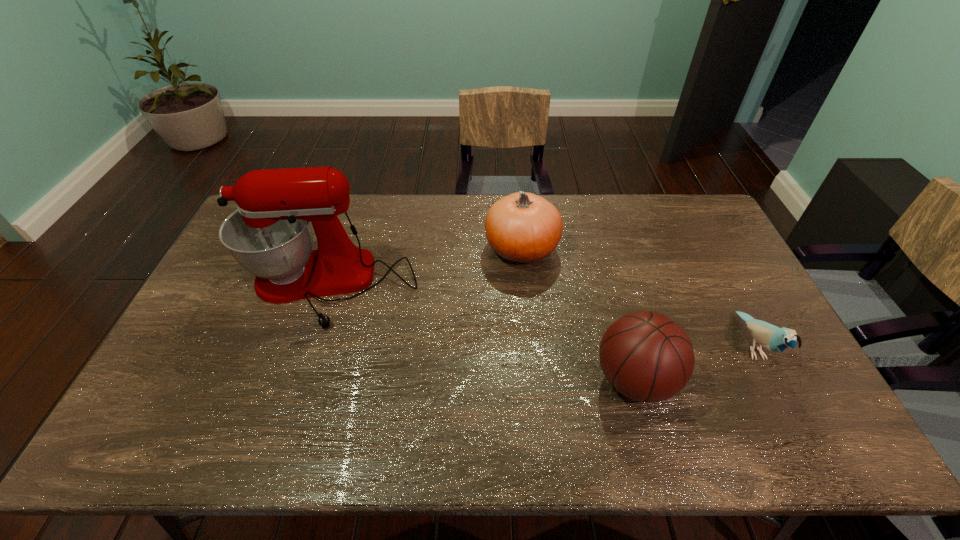
The width and height of the screenshot is (960, 540). In order to click on free space between the tallest object and the basketball in this screenshot , I will do `click(481, 334)`.

Find the location of a particular element. The image size is (960, 540). vacant space in between the pumpkin and the rightmost object is located at coordinates (636, 298).

Find the location of a particular element. This screenshot has height=540, width=960. vacant space that is in between the shortest object and the third object from right to left is located at coordinates (636, 298).

Find the location of `blank region between the leftmost object and the basketball`. blank region between the leftmost object and the basketball is located at coordinates (481, 334).

Find the location of a particular element. The image size is (960, 540). unoccupied position between the rightmost object and the second object from left to right is located at coordinates (636, 298).

Where is `vacant area between the shortest object and the tallest object`? vacant area between the shortest object and the tallest object is located at coordinates (540, 316).

Choose which object is the second nearest neighbor to the rightmost object. Please provide its 2D coordinates. Your answer should be formatted as a tuple, i.e. [(x, y)], where the tuple contains the x and y coordinates of a point satisfying the conditions above.

[(522, 227)]

The height and width of the screenshot is (540, 960). Identify the location of object that is the second nearest to the third object from right to left. (646, 356).

Where is `free space that satisfies the following two spatial constraints: 1. on the bowl side of the tallest object; 2. on the left side of the second object from right to left`? This screenshot has width=960, height=540. free space that satisfies the following two spatial constraints: 1. on the bowl side of the tallest object; 2. on the left side of the second object from right to left is located at coordinates (299, 380).

Where is `vacant space that satisfies the following two spatial constraints: 1. on the bowl side of the second object from right to left; 2. on the left side of the mixer`? The height and width of the screenshot is (540, 960). vacant space that satisfies the following two spatial constraints: 1. on the bowl side of the second object from right to left; 2. on the left side of the mixer is located at coordinates (299, 380).